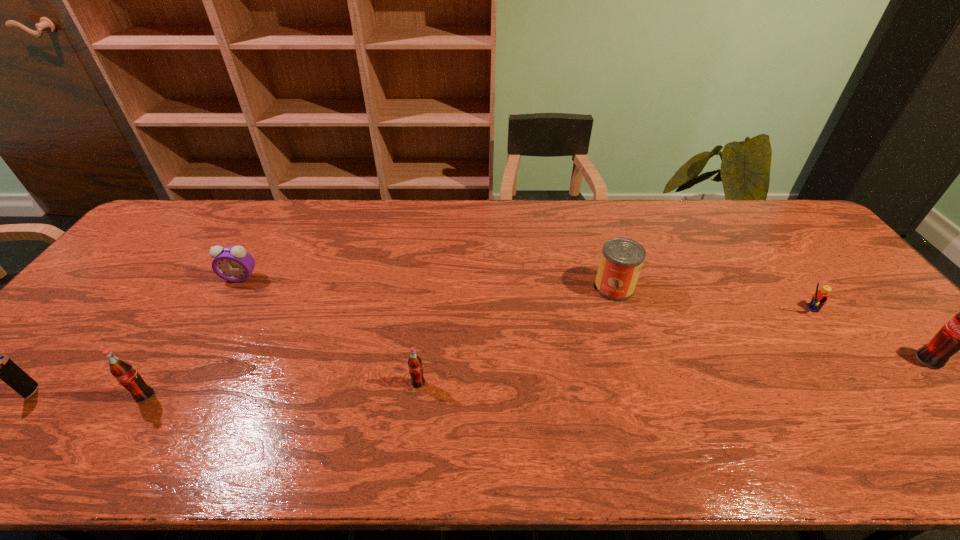
Where is `vacant space located 0.050m on the label of the fourth object from right to left`? vacant space located 0.050m on the label of the fourth object from right to left is located at coordinates (415, 408).

Locate an element on the screen. free region located 0.350m on the front-facing side of the fifth nearest object is located at coordinates (665, 308).

Find the location of `vacant space located on the front-facing side of the fifth nearest object`. vacant space located on the front-facing side of the fifth nearest object is located at coordinates pos(749,308).

You are a GUI agent. You are given a task and a screenshot of the screen. Output one action in this format:
    pyautogui.click(x=<x>, y=<y>)
    Task: Click on the free space located 0.250m on the front-facing side of the fifth nearest object
    
    Given the screenshot: What is the action you would take?
    pyautogui.click(x=702, y=308)

I want to click on vacant point located 0.330m on the face of the alarm clock, so click(181, 379).

Locate an element on the screen. The width and height of the screenshot is (960, 540). blank area located on the right of the igniter is located at coordinates (152, 392).

Where is `vacant space located 0.260m on the right of the fifth object from left to right`? vacant space located 0.260m on the right of the fifth object from left to right is located at coordinates (723, 287).

In order to click on igniter located in the near edge section of the desktop in this screenshot , I will do `click(3, 368)`.

Locate an element on the screen. The height and width of the screenshot is (540, 960). object present at the left edge is located at coordinates (3, 368).

Find the location of a particular element. The height and width of the screenshot is (540, 960). object positioned at the right edge is located at coordinates (959, 334).